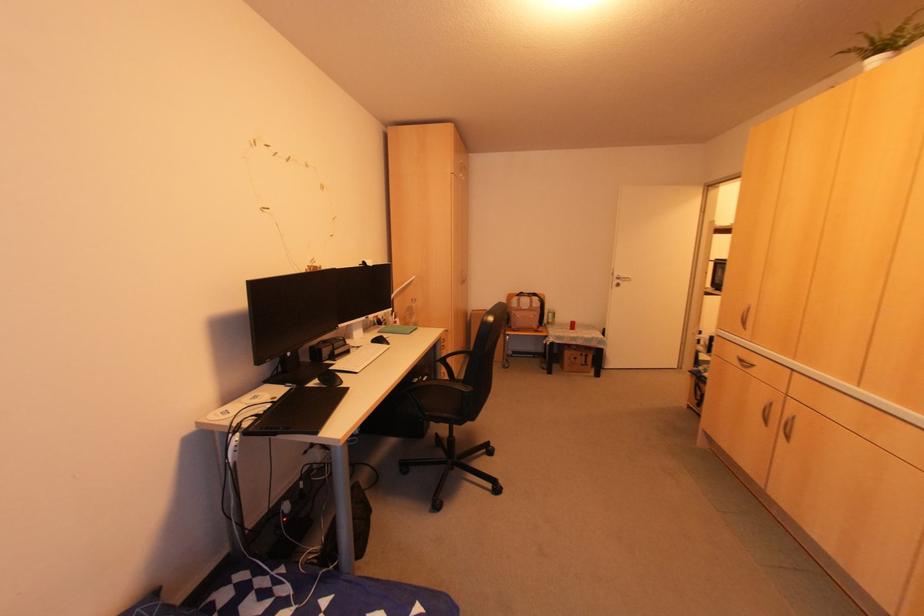
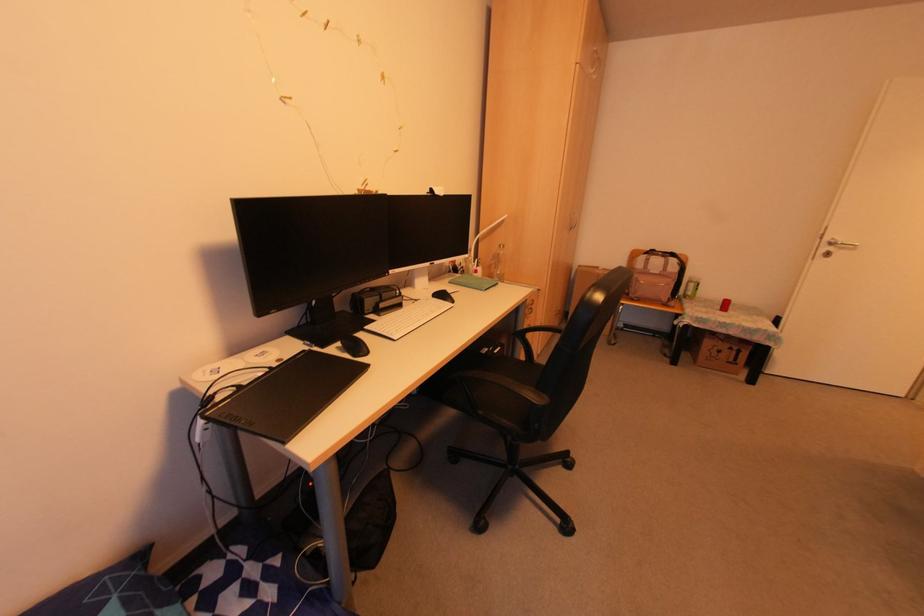
Locate, in the second image, the point that corresponds to point (339, 383) in the first image.

(365, 353)